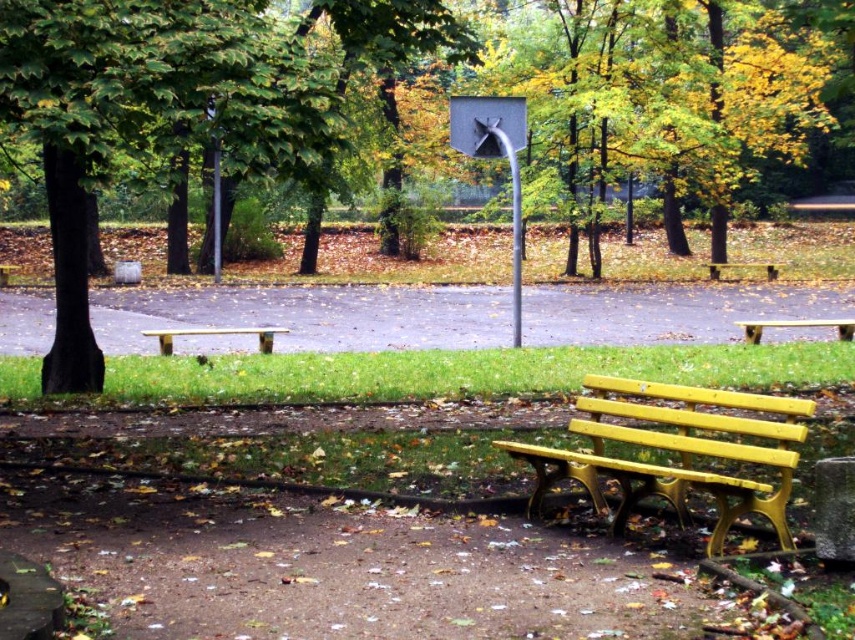
Question: Which point is closer to the camera taking this photo?

Choices:
 (A) (223, 332)
 (B) (516, 108)

Answer: (A)

Question: Does yellow plastic bench at lower right appear on the right side of wooden bench at center?

Choices:
 (A) yes
 (B) no

Answer: (A)

Question: Which object is positioned farthest from the yellow painted wood bench at center?

Choices:
 (A) wooden bench at center
 (B) metallic gray basketball hoop at center

Answer: (A)

Question: Estimate the real-world distances between objects in this image. Which object is closer to the yellow painted wood bench at center?

Choices:
 (A) yellow painted wood bench at right
 (B) yellow plastic bench at lower right
 (C) metallic gray basketball hoop at center
 (D) wooden bench at center

Answer: (C)

Question: Does yellow plastic bench at lower right appear over metallic gray basketball hoop at center?

Choices:
 (A) yes
 (B) no

Answer: (B)

Question: Can you confirm if yellow plastic bench at lower right is positioned above wooden bench at center?

Choices:
 (A) no
 (B) yes

Answer: (A)